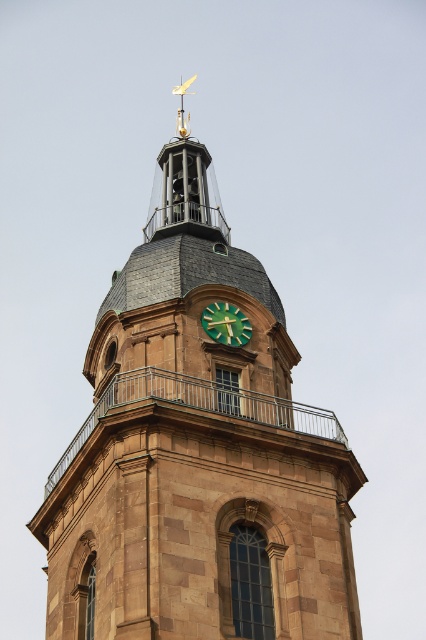
Measure the distance between brown stone clock tower at center and gold-plated weather vane at top.

brown stone clock tower at center and gold-plated weather vane at top are 11.11 meters apart from each other.

Does brown stone clock tower at center come behind gold-plated weather vane at top?

That is False.

Locate an element on the screen. brown stone clock tower at center is located at coordinates (196, 452).

Find the location of `brown stone clock tower at center`. brown stone clock tower at center is located at coordinates (196, 452).

The width and height of the screenshot is (426, 640). What do you see at coordinates (196, 452) in the screenshot?
I see `brown stone clock tower at center` at bounding box center [196, 452].

Who is positioned more to the left, brown stone clock tower at center or green matte clock at center?

From the viewer's perspective, brown stone clock tower at center appears more on the left side.

Find the location of a particular element. brown stone clock tower at center is located at coordinates (196, 452).

Measure the distance from gold-plated weather vane at top to green matte clock at center.

gold-plated weather vane at top and green matte clock at center are 43.29 feet apart.

Between gold-plated weather vane at top and green matte clock at center, which one has less height?

green matte clock at center is shorter.

Between point (184, 173) and point (218, 310), which one is positioned in front?

Point (218, 310)

Where is `gold-plated weather vane at top`? gold-plated weather vane at top is located at coordinates (186, 186).